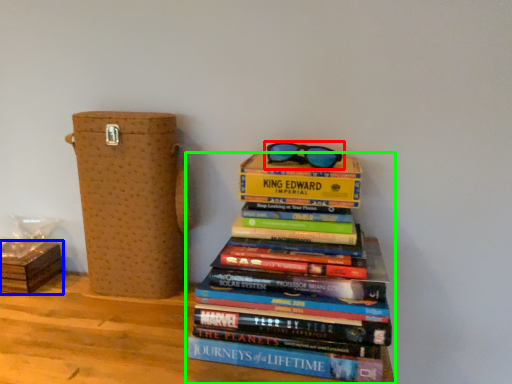
Question: Which object is positioned closest to glasses (highlighted by a red box)? Select from cardboard box (highlighted by a blue box) and book (highlighted by a green box).

Choices:
 (A) cardboard box
 (B) book

Answer: (B)